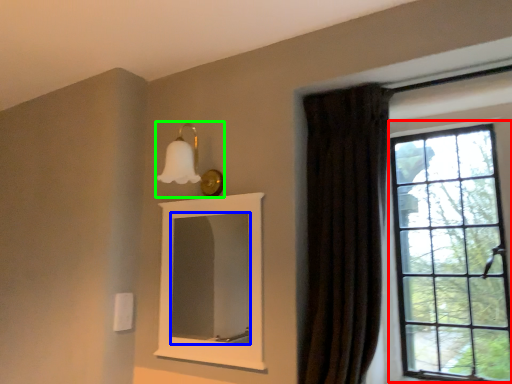
Question: Which object is positioned closest to window (highlighted by a red box)? Select from mirror (highlighted by a blue box) and light fixture (highlighted by a green box).

Choices:
 (A) mirror
 (B) light fixture

Answer: (B)